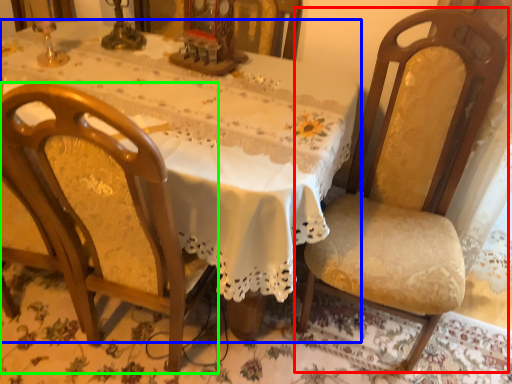
Question: Considering the real-world distances, which object is farthest from chair (highlighted by a red box)? table (highlighted by a blue box) or chair (highlighted by a green box)?

Choices:
 (A) table
 (B) chair

Answer: (B)